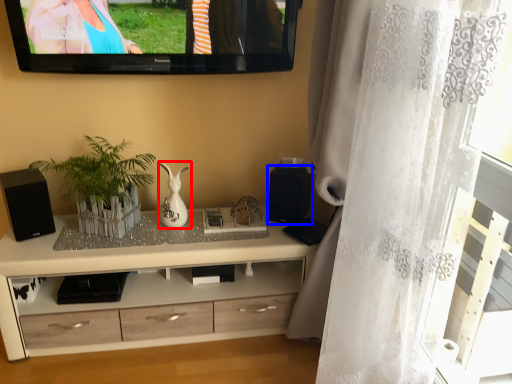
Question: Which object appears farthest to the camera in this image, vase (highlighted by a red box) or speaker (highlighted by a blue box)?

Choices:
 (A) vase
 (B) speaker

Answer: (B)